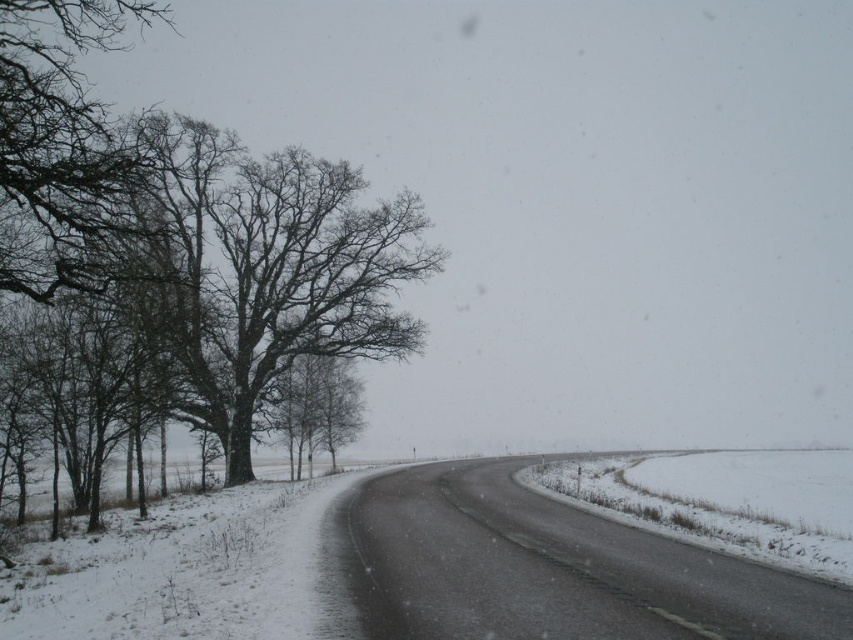
Consider the image. You are a hiker trying to navigate the snowy road in the image. You notice the dark brown bark tree at left and the bare branches at left. Which object is closer to the road?

The dark brown bark tree at left is located below bare branches at left, meaning it is closer to the road than the bare branches at left.

You are a hiker trying to navigate through the snowy landscape. You notice the dark brown bark tree at left and the bare branches at left. Which one would you use as a reference point for your path if you want to stay closer to the road?

The dark brown bark tree at left has a smaller size compared to bare branches at left, so the bare branches at left would be a better reference point as it is larger and more visible from a distance.